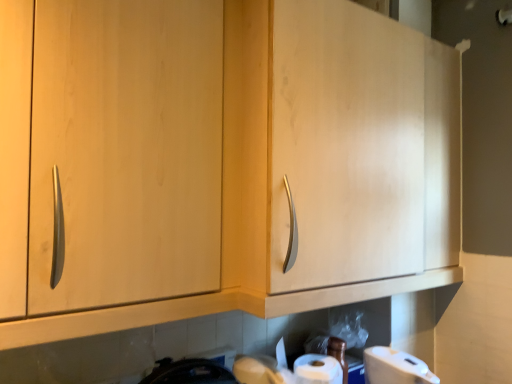
This screenshot has width=512, height=384. What are the coordinates of `matte wood cabinet at center` in the screenshot? It's located at (336, 156).

The height and width of the screenshot is (384, 512). What do you see at coordinates (336, 156) in the screenshot? I see `matte wood cabinet at center` at bounding box center [336, 156].

This screenshot has width=512, height=384. Identify the location of white matte toilet paper at lower right. pyautogui.click(x=395, y=367).

What do you see at coordinates (395, 367) in the screenshot? This screenshot has height=384, width=512. I see `white matte toilet paper at lower right` at bounding box center [395, 367].

Where is `matte wood cabinet at center`? matte wood cabinet at center is located at coordinates (336, 156).

Considering the relative positions of white matte toilet paper at lower right and matte wood cabinet at center in the image provided, is white matte toilet paper at lower right to the right of matte wood cabinet at center from the viewer's perspective?

Indeed, white matte toilet paper at lower right is positioned on the right side of matte wood cabinet at center.

Relative to matte wood cabinet at center, is white matte toilet paper at lower right in front or behind?

white matte toilet paper at lower right is positioned farther from the viewer than matte wood cabinet at center.

Which is less distant, (388, 374) or (385, 215)?

Clearly, point (388, 374) is closer to the camera than point (385, 215).

From the image's perspective, between white matte toilet paper at lower right and matte wood cabinet at center, who is located below?

From the image's view, white matte toilet paper at lower right is below.

From a real-world perspective, between white matte toilet paper at lower right and matte wood cabinet at center, who is vertically lower?

white matte toilet paper at lower right, from a real-world perspective.

From the picture: Can you confirm if white matte toilet paper at lower right is thinner than matte wood cabinet at center?

Yes, white matte toilet paper at lower right is thinner than matte wood cabinet at center.

Consider the image. Between white matte toilet paper at lower right and matte wood cabinet at center, which one has more height?

With more height is matte wood cabinet at center.

Is white matte toilet paper at lower right bigger or smaller than matte wood cabinet at center?

white matte toilet paper at lower right is smaller than matte wood cabinet at center.

Is white matte toilet paper at lower right positioned beyond the bounds of matte wood cabinet at center?

Indeed, white matte toilet paper at lower right is completely outside matte wood cabinet at center.

Is white matte toilet paper at lower right far away from matte wood cabinet at center?

No, white matte toilet paper at lower right is not far from matte wood cabinet at center.

Is white matte toilet paper at lower right oriented towards matte wood cabinet at center?

No, white matte toilet paper at lower right is not aimed at matte wood cabinet at center.

In order to click on toilet paper behind the matte wood cabinet at center in this screenshot , I will do `click(395, 367)`.

Is matte wood cabinet at center at the right side of white matte toilet paper at lower right?

Incorrect, matte wood cabinet at center is not on the right side of white matte toilet paper at lower right.

Is matte wood cabinet at center in front of or behind white matte toilet paper at lower right in the image?

Clearly, matte wood cabinet at center is in front of white matte toilet paper at lower right.

Is point (229, 193) closer to camera compared to point (379, 377)?

Yes, point (229, 193) is closer to viewer.

From the image's perspective, is matte wood cabinet at center on top of white matte toilet paper at lower right?

Yes, from the image's perspective, matte wood cabinet at center is on top of white matte toilet paper at lower right.

From a real-world perspective, is matte wood cabinet at center over white matte toilet paper at lower right?

Correct, in the physical world, matte wood cabinet at center is higher than white matte toilet paper at lower right.

Looking at their sizes, would you say matte wood cabinet at center is wider or thinner than white matte toilet paper at lower right?

matte wood cabinet at center is wider than white matte toilet paper at lower right.

Considering the sizes of matte wood cabinet at center and white matte toilet paper at lower right in the image, is matte wood cabinet at center taller or shorter than white matte toilet paper at lower right?

Considering their sizes, matte wood cabinet at center has more height than white matte toilet paper at lower right.

In the scene shown: Based on their sizes in the image, would you say matte wood cabinet at center is bigger or smaller than white matte toilet paper at lower right?

matte wood cabinet at center is bigger than white matte toilet paper at lower right.

Looking at this image, is matte wood cabinet at center situated inside white matte toilet paper at lower right or outside?

matte wood cabinet at center cannot be found inside white matte toilet paper at lower right.

Can you see matte wood cabinet at center touching white matte toilet paper at lower right?

No, matte wood cabinet at center is not touching white matte toilet paper at lower right.

Does matte wood cabinet at center turn towards white matte toilet paper at lower right?

No.

Looking at this image, how many degrees apart are the facing directions of matte wood cabinet at center and white matte toilet paper at lower right?

The angle between the facing direction of matte wood cabinet at center and the facing direction of white matte toilet paper at lower right is 52.9 degrees.

Measure the distance between matte wood cabinet at center and white matte toilet paper at lower right.

The distance of matte wood cabinet at center from white matte toilet paper at lower right is 20.41 inches.

You are a GUI agent. You are given a task and a screenshot of the screen. Output one action in this format:
    pyautogui.click(x=<x>, y=<y>)
    Task: Click on the cabinetry lying above the white matte toilet paper at lower right (from the image's perspective)
    
    Given the screenshot: What is the action you would take?
    pos(336,156)

Image resolution: width=512 pixels, height=384 pixels. I want to click on cabinetry on the left of the white matte toilet paper at lower right, so click(x=336, y=156).

At what (x,y) coordinates should I click in order to perform the action: click on cabinetry above the white matte toilet paper at lower right (from a real-world perspective). Please return your answer as a coordinate pair (x, y). This screenshot has height=384, width=512. Looking at the image, I should click on (336, 156).